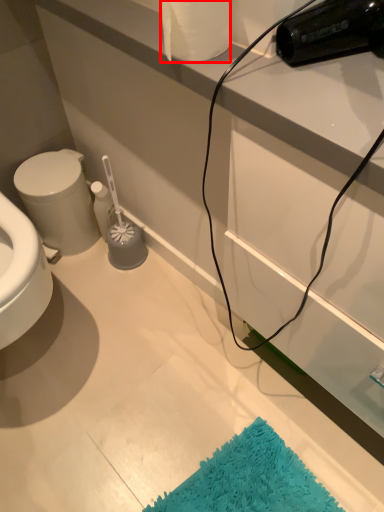
Question: From the image's perspective, where is toilet paper (annotated by the red box) located in relation to bidet in the image?

Choices:
 (A) above
 (B) below

Answer: (A)